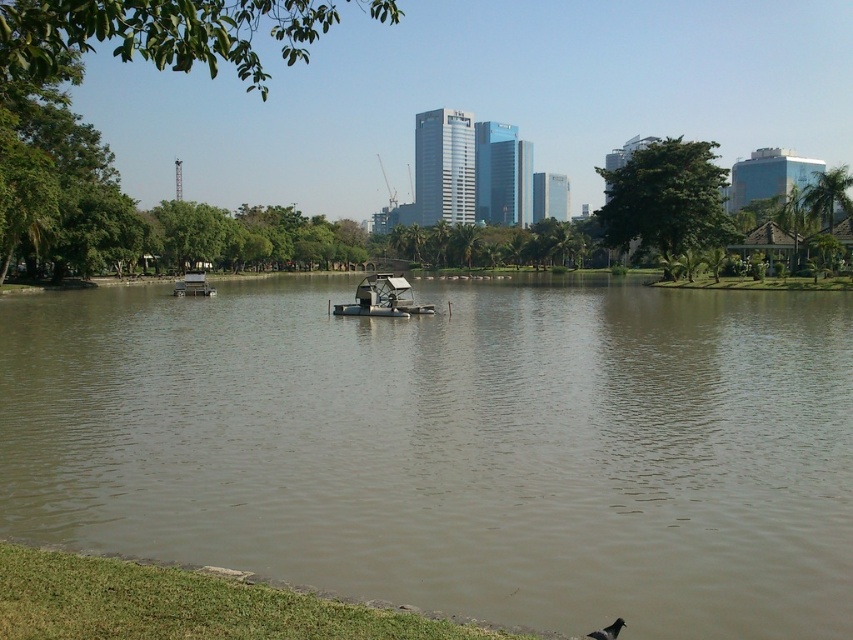
You are a park visitor who wants to take a closer look at the metallic silver paddlewheel boat at center. However, you are standing on the edge of the brown murky water at center. Can you safely walk towards the boat without getting into the water?

The brown murky water at center has a larger size compared to metallic silver paddlewheel boat at center, so the boat is likely surrounded by the murky water. Walking towards it may require entering the water, which might not be safe.

You are standing at the edge of the park facing the water. There are two points marked on the water surface, one at coordinates point (x=715, y=499) and the other at point (x=405, y=298). Which point is nearer to your current position?

Point (x=715, y=499) is closer to the camera than point (x=405, y=298), so the point at coordinates point (x=715, y=499) is nearer to your current position.

You are standing on the dock and see the white plastic boat at center and the gray matte bird at lower right. Which object is closer to the left side of the image?

The white plastic boat at center is to the left of the gray matte bird at lower right, so it is closer to the left side of the image.